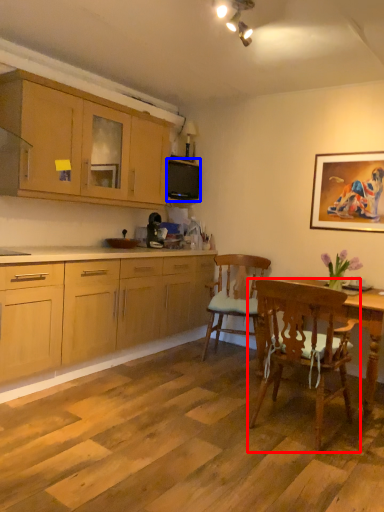
Question: Which of the following is the farthest to the observer, chair (highlighted by a red box) or microwave oven (highlighted by a blue box)?

Choices:
 (A) chair
 (B) microwave oven

Answer: (B)